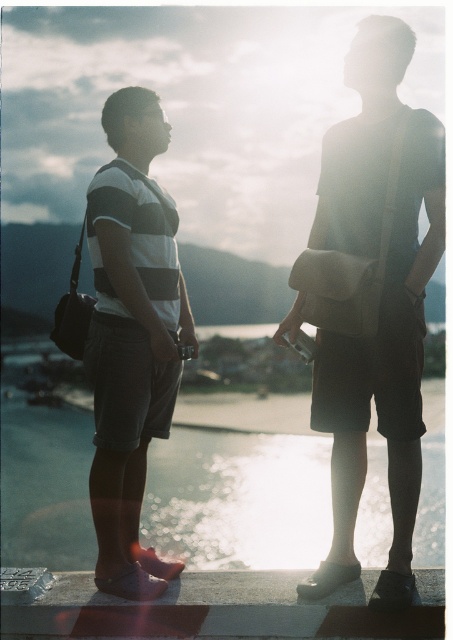
Question: Is translucent glass water at center to the left of striped cotton shirt at left from the viewer's perspective?

Choices:
 (A) yes
 (B) no

Answer: (A)

Question: Which object is farther from the camera taking this photo?

Choices:
 (A) translucent glass water at center
 (B) striped cotton shirt at left

Answer: (A)

Question: Based on their relative distances, which object is nearer to the matte beige bag at center?

Choices:
 (A) translucent glass water at center
 (B) striped cotton shirt at left

Answer: (B)

Question: Which point appears closest to the camera in this image?

Choices:
 (A) (164, 353)
 (B) (18, 548)
 (C) (331, 387)

Answer: (C)

Question: Is translucent glass water at center to the right of matte beige bag at center from the viewer's perspective?

Choices:
 (A) no
 (B) yes

Answer: (A)

Question: Is matte beige bag at center wider than striped cotton shirt at left?

Choices:
 (A) yes
 (B) no

Answer: (A)